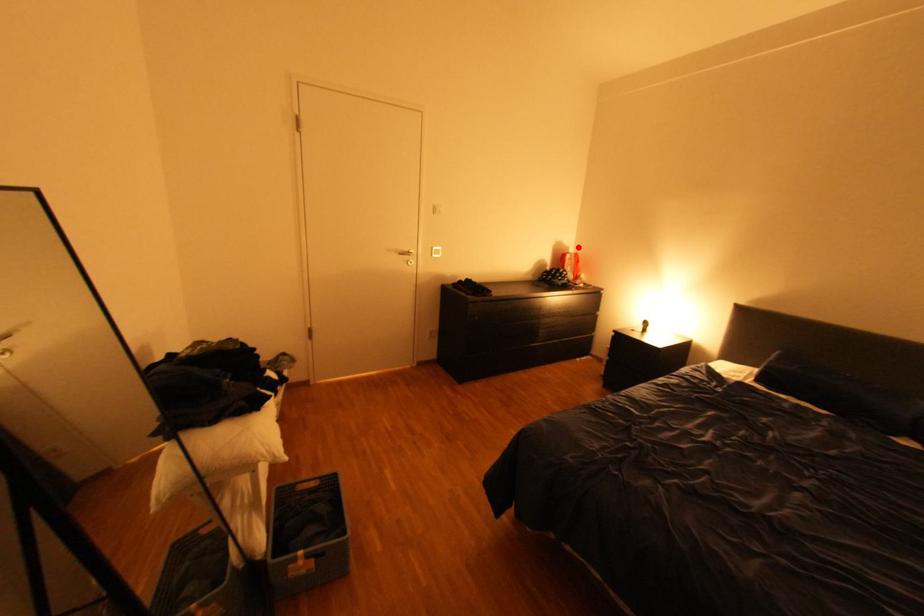
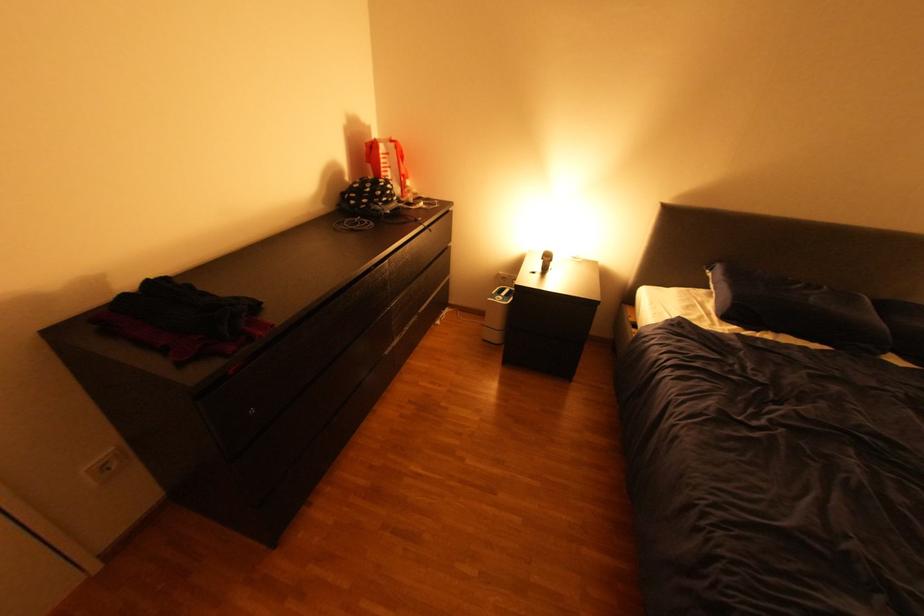
Find the pixel in the second image that matches the highlighted location in the first image.

(379, 129)